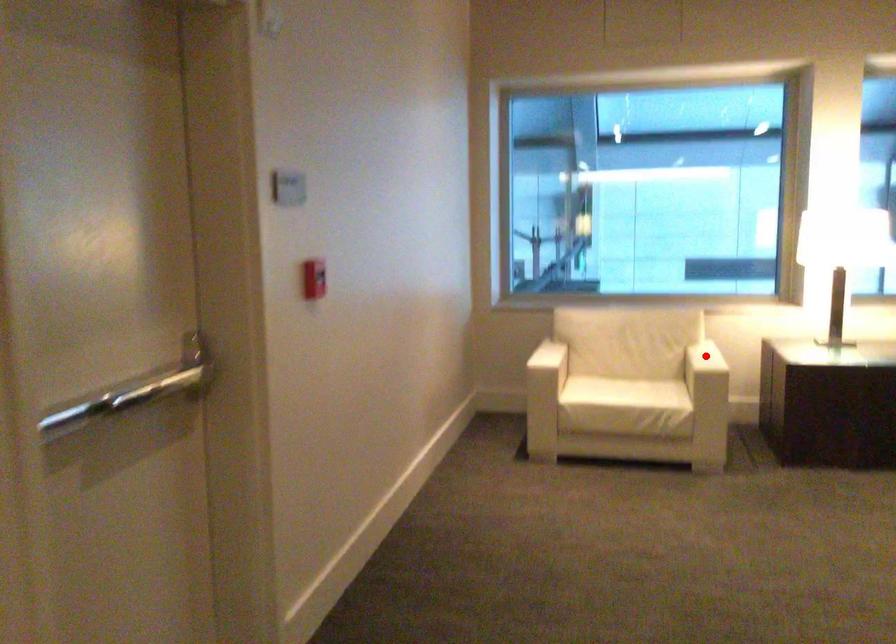
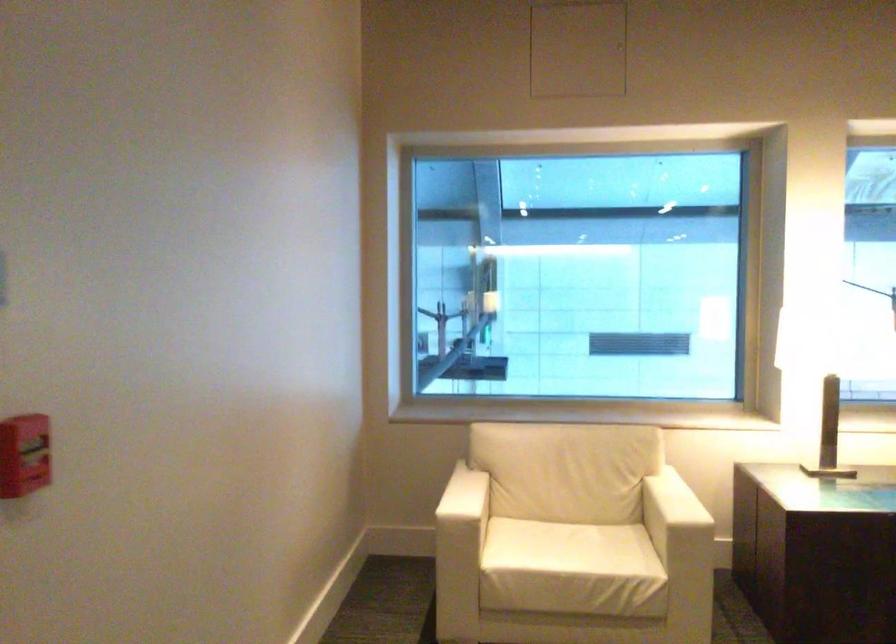
Where in the second image is the point corresponding to the highlighted location from the first image?

(673, 504)